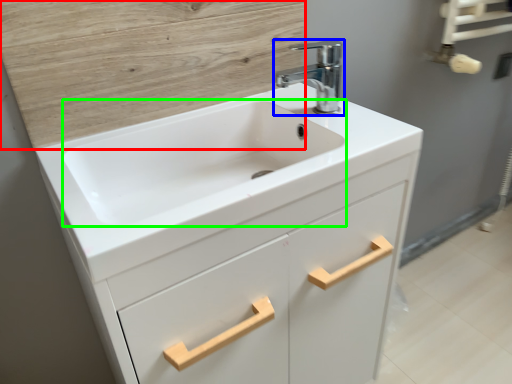
Question: Considering the real-world distances, which object is closest to plywood (highlighted by a red box)? tap (highlighted by a blue box) or sink (highlighted by a green box).

Choices:
 (A) tap
 (B) sink

Answer: (B)